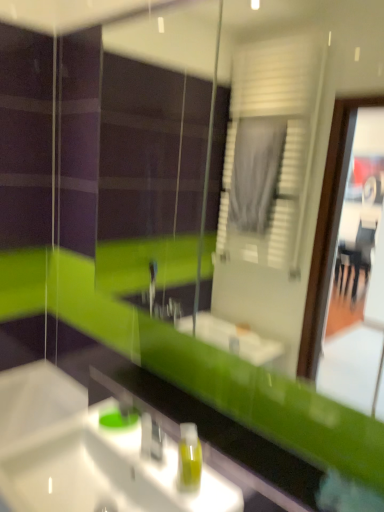
Identify the location of free space in front of teal glass soap dispenser at center. (128, 443).